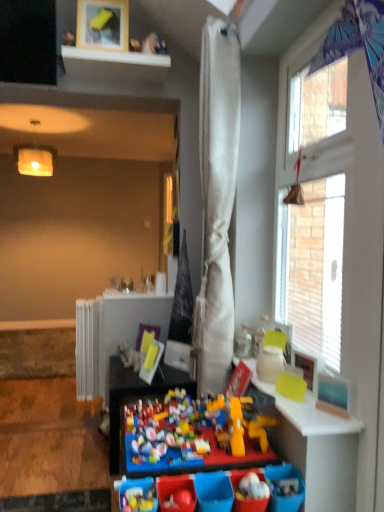
Where is `empty space that is ontop of white glossy shelf at upper center (from a real-world perspective)`? This screenshot has height=512, width=384. empty space that is ontop of white glossy shelf at upper center (from a real-world perspective) is located at coordinates (122, 57).